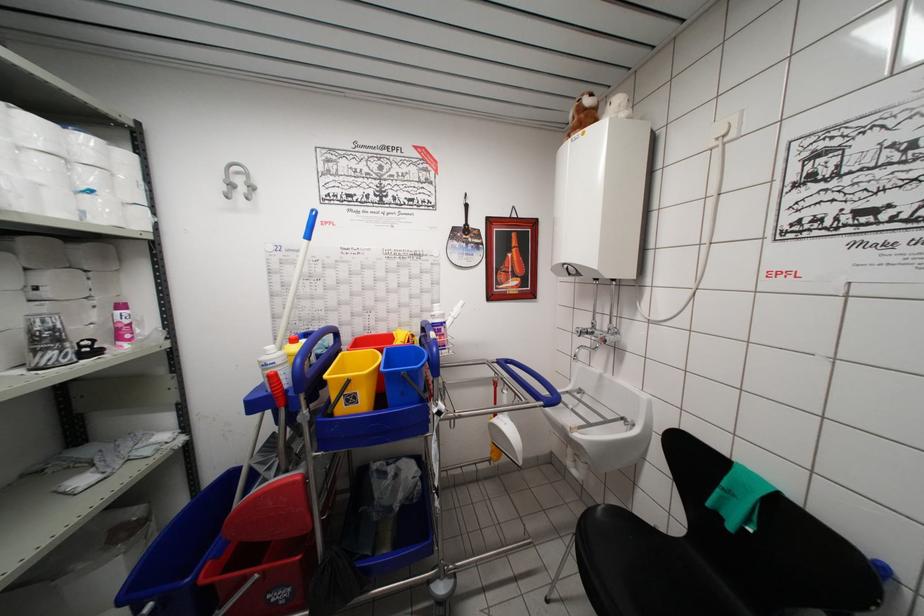
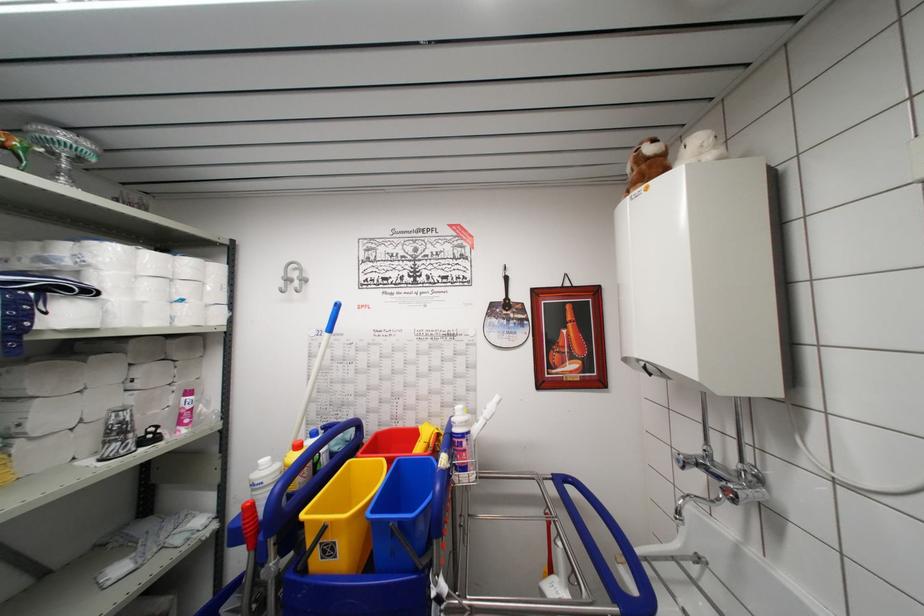
In the scene shown: In a continuous first-person perspective shot, in which direction is the camera moving?

The cameraman walked toward right, forward.